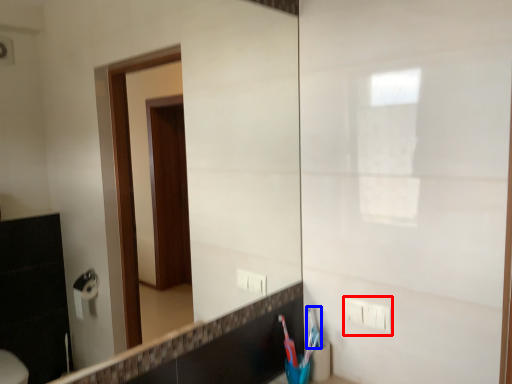
Question: Which point is further to the camera, electric outlet (highlighted by a red box) or toothbrush (highlighted by a blue box)?

Choices:
 (A) electric outlet
 (B) toothbrush

Answer: (B)